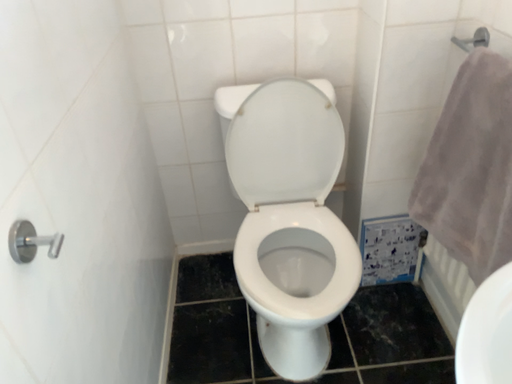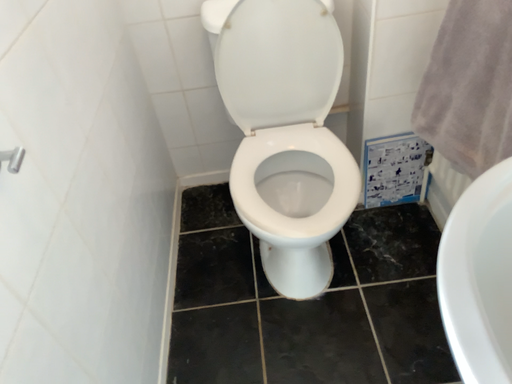
Question: Which way did the camera rotate in the video?

Choices:
 (A) rotated upward
 (B) rotated downward

Answer: (B)